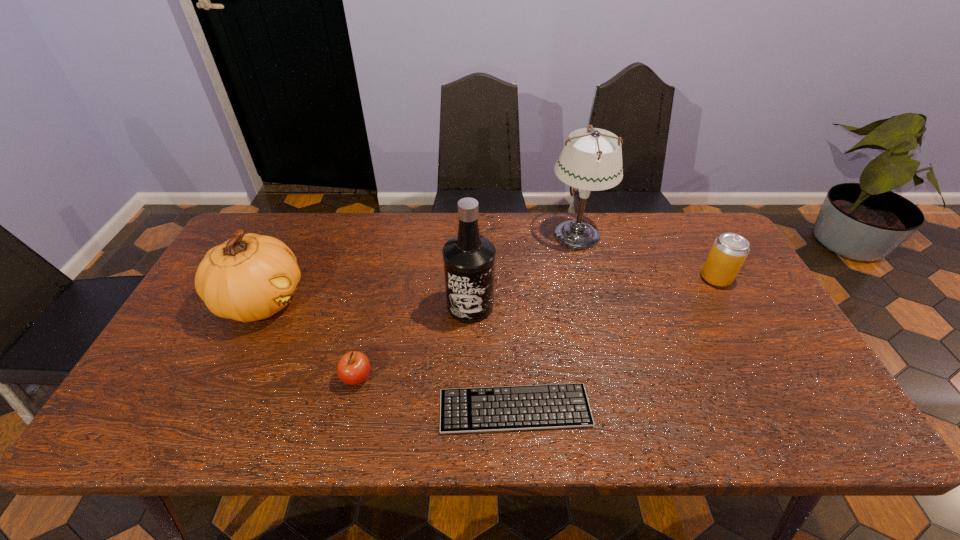
Locate an element on the screen. The image size is (960, 540). object present at the right edge is located at coordinates (729, 251).

At what (x,y) coordinates should I click in order to perform the action: click on blank area at the far edge. Please return your answer as a coordinate pair (x, y). The width and height of the screenshot is (960, 540). Looking at the image, I should click on (668, 241).

Image resolution: width=960 pixels, height=540 pixels. I want to click on free space at the near edge, so click(225, 438).

The width and height of the screenshot is (960, 540). Identify the location of vacant area at the left edge of the desktop. (188, 314).

Find the location of a particular element. Image resolution: width=960 pixels, height=540 pixels. free region at the right edge of the desktop is located at coordinates (754, 293).

In the image, there is a desktop. Where is `vacant space at the near left corner`? This screenshot has width=960, height=540. vacant space at the near left corner is located at coordinates (171, 427).

You are a GUI agent. You are given a task and a screenshot of the screen. Output one action in this format:
    pyautogui.click(x=<x>, y=<y>)
    Task: Click on the vacant space at the near right corner of the desktop
    
    Given the screenshot: What is the action you would take?
    pyautogui.click(x=767, y=415)

In order to click on free space between the fifth object from right to left and the liquor in this screenshot , I will do `click(414, 342)`.

Where is `unoccupied area between the liquor and the rightmost object`? This screenshot has width=960, height=540. unoccupied area between the liquor and the rightmost object is located at coordinates (593, 292).

You are a GUI agent. You are given a task and a screenshot of the screen. Output one action in this format:
    pyautogui.click(x=<x>, y=<y>)
    Task: Click on the vacant space that is in between the pumpkin and the liquor
    
    Given the screenshot: What is the action you would take?
    pyautogui.click(x=366, y=303)